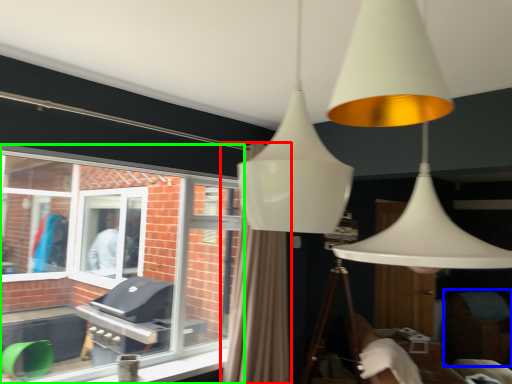
Question: Estimate the real-world distances between objects in this image. Which object is farther from curtain (highlighted by a red box), swivel chair (highlighted by a blue box) or window (highlighted by a green box)?

Choices:
 (A) swivel chair
 (B) window

Answer: (A)